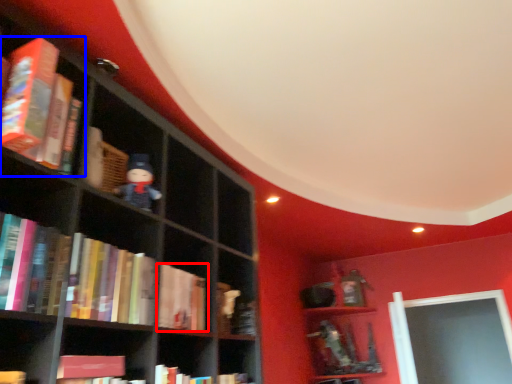
Question: Among these objects, which one is nearest to the camera, book (highlighted by a red box) or book (highlighted by a blue box)?

Choices:
 (A) book
 (B) book

Answer: (B)